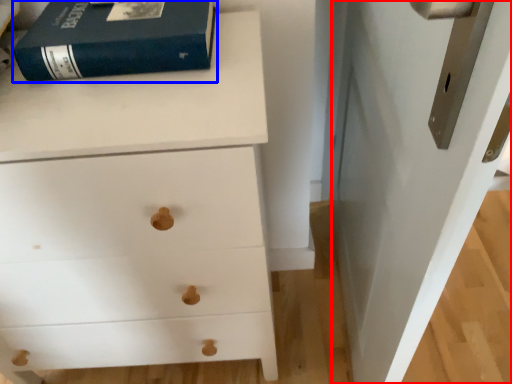
Question: Which object is further to the camera taking this photo, door (highlighted by a red box) or paperback book (highlighted by a blue box)?

Choices:
 (A) door
 (B) paperback book

Answer: (B)